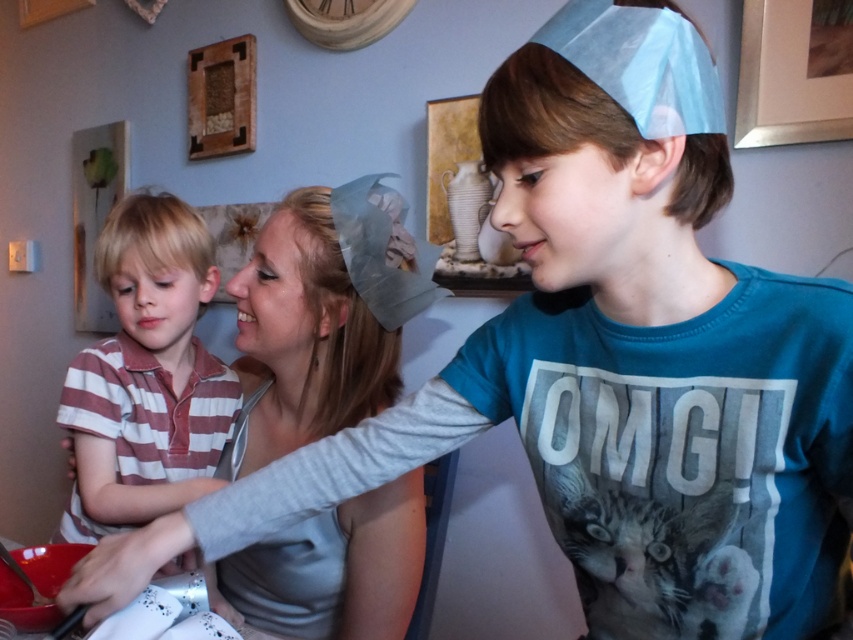
Looking at this image, you are a photographer trying to capture the perfect shot of the gray fabric headband at upper center and the striped cotton shirt at left. Based on their positions, which object should you focus on first to ensure both are in the frame?

The gray fabric headband at upper center is below the striped cotton shirt at left, so you should focus on the striped cotton shirt at left first to ensure both are in the frame.

You are standing in the scene and want to place a small gift between the two points, point (308, 609) and point (106, 278). Which point should the gift be closer to in order to be nearer to the viewer?

The gift should be closer to point (308, 609) because it is nearer to the viewer than point (106, 278).